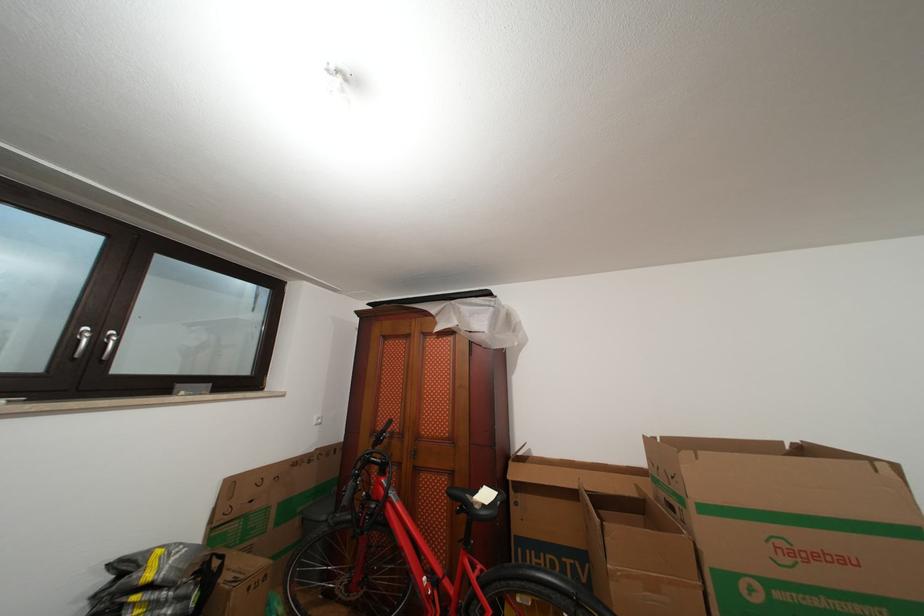
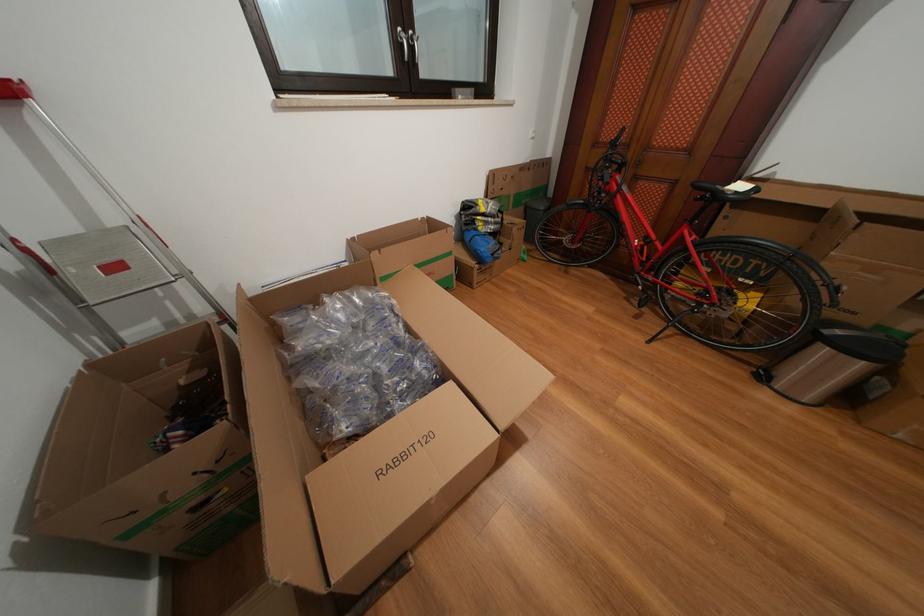
Locate, in the second image, the point that corresponds to the point at 93,333 in the first image.

(407, 34)